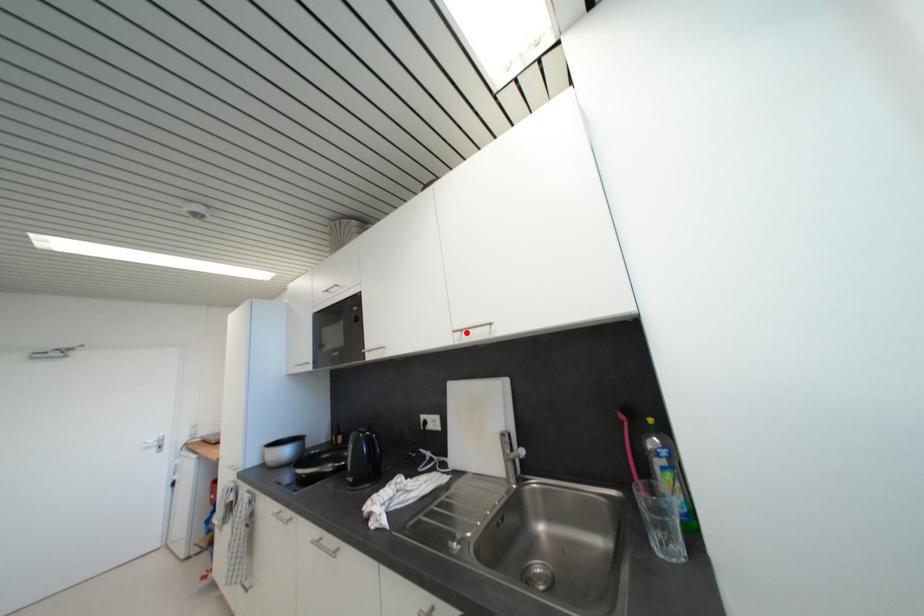
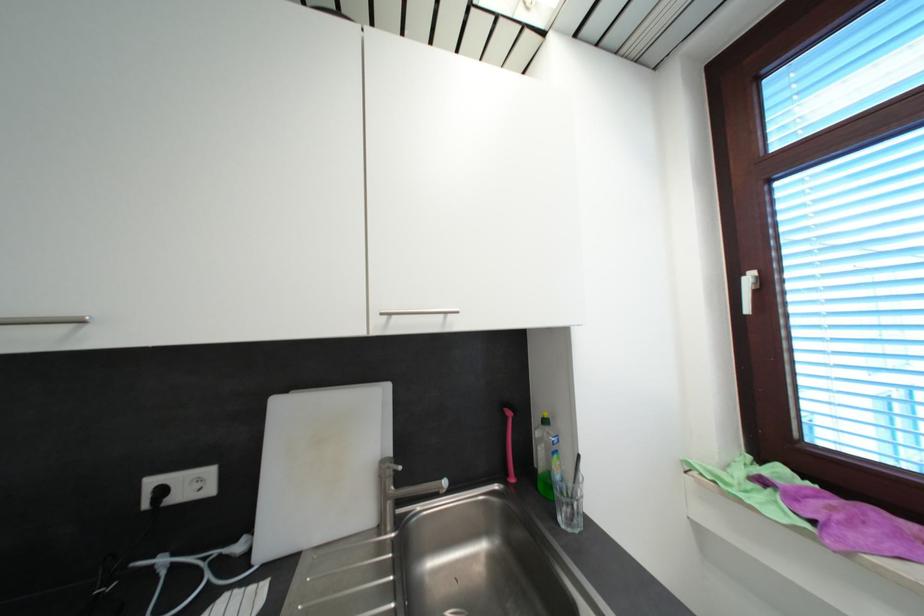
Where in the second image is the point corresponding to the highlighted location from the first image?

(395, 315)